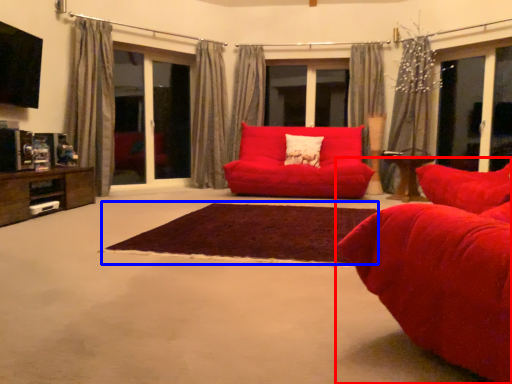
Question: Which object is further to the camera taking this photo, studio couch (highlighted by a red box) or plain (highlighted by a blue box)?

Choices:
 (A) studio couch
 (B) plain

Answer: (B)